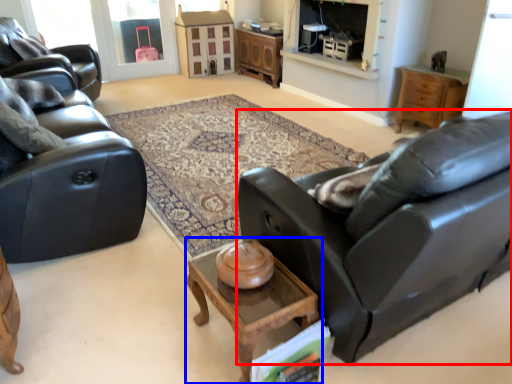
Question: Which of the following is the farthest to the observer, studio couch (highlighted by a red box) or coffee table (highlighted by a blue box)?

Choices:
 (A) studio couch
 (B) coffee table

Answer: (B)